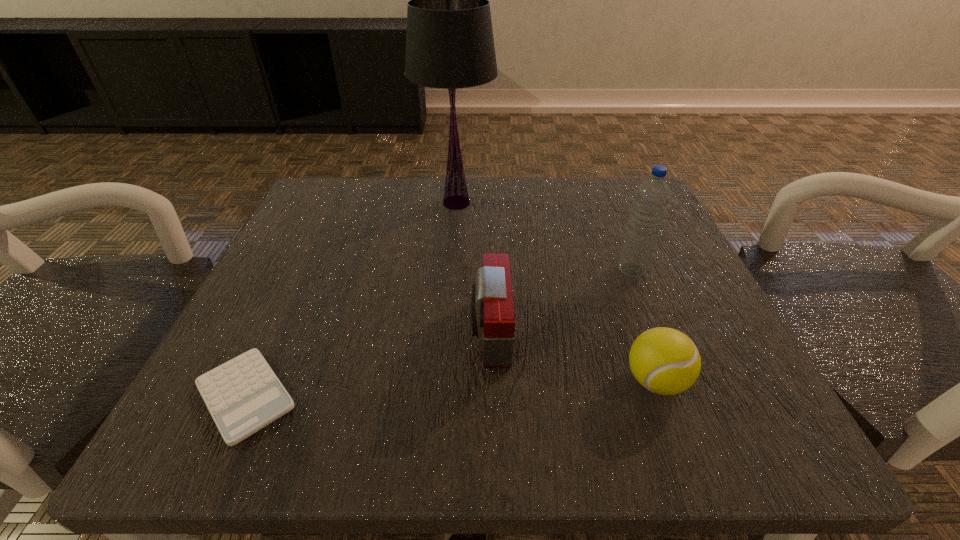
Locate an element on the screen. The height and width of the screenshot is (540, 960). lampshade is located at coordinates (449, 41).

The width and height of the screenshot is (960, 540). I want to click on the farthest object, so click(449, 41).

Identify the location of the second farthest object. (652, 196).

Where is `water bottle`? The height and width of the screenshot is (540, 960). water bottle is located at coordinates (652, 196).

Image resolution: width=960 pixels, height=540 pixels. In order to click on camera in this screenshot , I will do `click(492, 315)`.

You are a GUI agent. You are given a task and a screenshot of the screen. Output one action in this format:
    pyautogui.click(x=<x>, y=<y>)
    Task: Click on the tennis ball
    Image resolution: width=960 pixels, height=540 pixels.
    Given the screenshot: What is the action you would take?
    pyautogui.click(x=665, y=361)

Where is `the leftmost object`? the leftmost object is located at coordinates (243, 395).

Where is `calculator`? The width and height of the screenshot is (960, 540). calculator is located at coordinates (243, 395).

Locate an element on the screen. Image resolution: width=960 pixels, height=540 pixels. free region located 0.290m on the front-facing side of the tallest object is located at coordinates click(446, 334).

Identify the location of free space located 0.060m on the left of the water bottle. (583, 269).